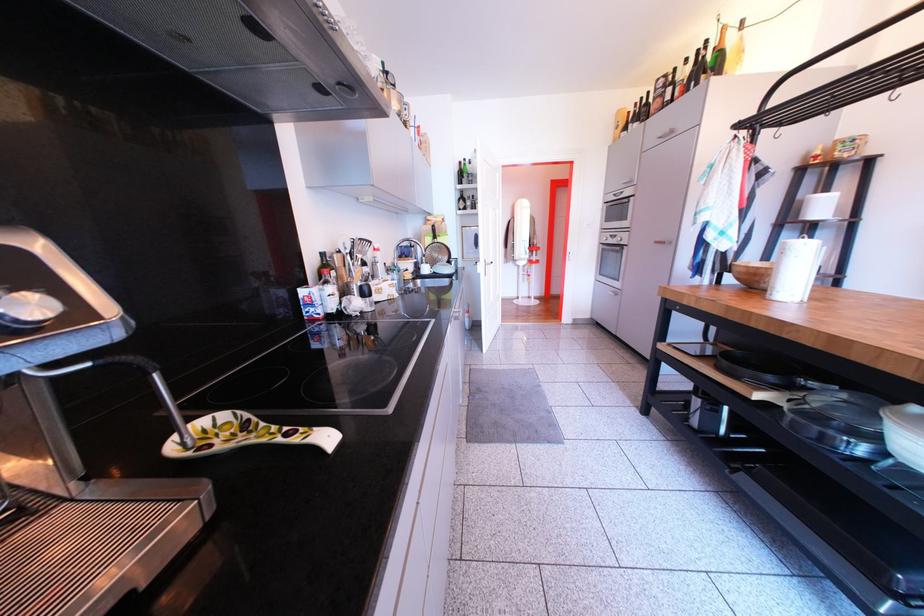
Where would you pull the oven door handle? Please return your answer as a coordinate pair (x, y).

(616, 238)